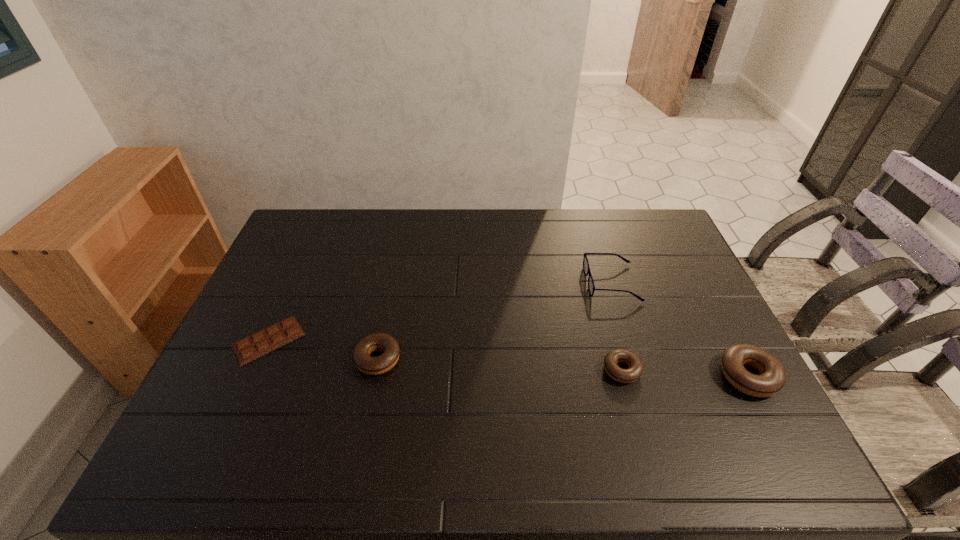
Find the location of a particular element. The image size is (960, 540). unoccupied area between the leftmost object and the rightmost object is located at coordinates (508, 358).

What are the coordinates of `vacant space in between the spectacles and the chocolate bar` in the screenshot? It's located at (440, 312).

Identify the location of vacant space in between the second shortest object and the spectacles. The width and height of the screenshot is (960, 540). pos(616,326).

Image resolution: width=960 pixels, height=540 pixels. Identify the location of blank region between the spectacles and the rightmost object. (680, 329).

Find the location of a particular element. This screenshot has width=960, height=540. empty space that is in between the spectacles and the third tallest object is located at coordinates (494, 321).

Where is `free area in between the rightmost doughnut and the shortest doughnut`? This screenshot has height=540, width=960. free area in between the rightmost doughnut and the shortest doughnut is located at coordinates (684, 373).

Choose which object is the second nearest neighbor to the fourth object from right to left. Please provide its 2D coordinates. Your answer should be formatted as a tuple, i.e. [(x, y)], where the tuple contains the x and y coordinates of a point satisfying the conditions above.

[(635, 369)]

Choose which object is the third nearest neighbor to the second tallest doughnut. Please provide its 2D coordinates. Your answer should be formatted as a tuple, i.e. [(x, y)], where the tuple contains the x and y coordinates of a point satisfying the conditions above.

[(591, 287)]

I want to click on doughnut that can be found as the second closest to the leftmost object, so click(x=635, y=369).

Locate an element on the screen. doughnut that is the closest one to the second object from left to right is located at coordinates (635, 369).